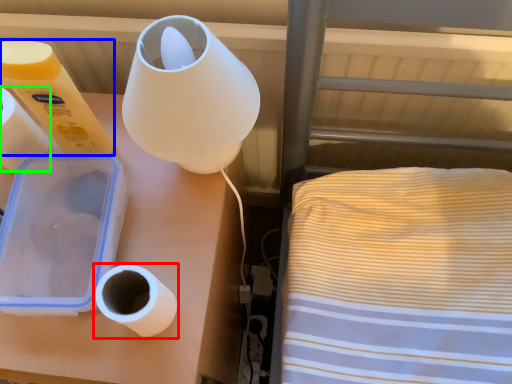
Question: Considering the real-world distances, which object is farthest from toilet paper (highlighted by a red box)? toilet paper (highlighted by a blue box) or paper towel (highlighted by a green box)?

Choices:
 (A) toilet paper
 (B) paper towel

Answer: (B)